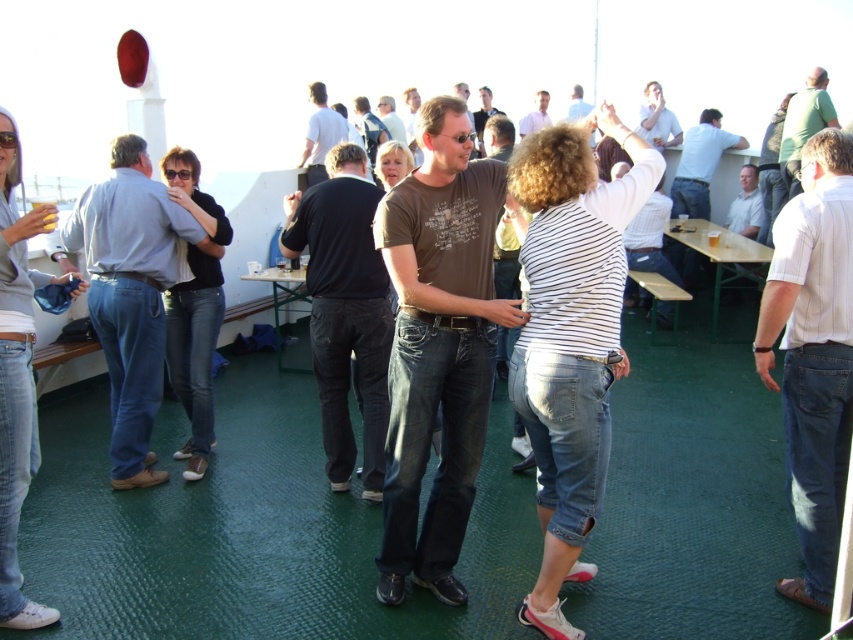
You are organizing a photo shoot and need to ensure that the white shirt at upper center and the brown cotton shirt at center are visible in the frame. Given their sizes, which shirt might require more space horizontally to be fully captured?

The white shirt at upper center requires more horizontal space because its width surpasses that of the brown cotton shirt at center.

You are a photographer trying to capture a candid shot of the brown cotton shirt at center without including the white shirt at upper center in the frame. Is this possible given their positions?

The white shirt at upper center is in front of the brown cotton shirt at center, so it would block the view. Therefore, capturing the brown cotton shirt at center without the white shirt at upper center in the frame is not possible.